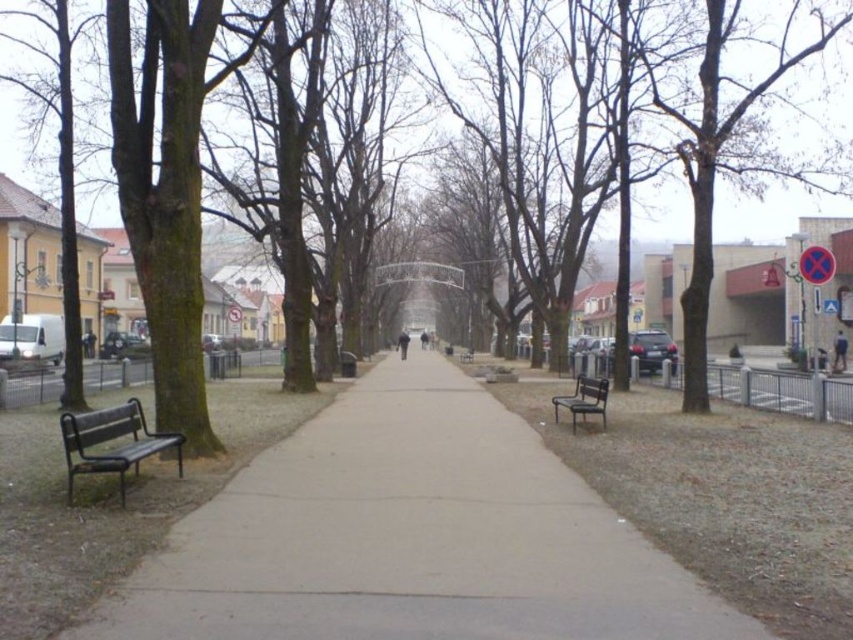
You are planning to hang a bird feeder on the brown rough tree at left and the metallic black bench at left. Which object can support the feeder better based on their height?

The brown rough tree at left has a greater height compared to the metallic black bench at left, so it can support the bird feeder better.

You are standing at the starting point of the pathway in the park and want to walk towards the end of the pathway. Which point, point [125,22] or point [122,445], is closer to you as you begin your walk?

Point [125,22] is closer to you because it is further to the camera than point [122,445], meaning it is nearer to your starting position at the beginning of the pathway.

You are a park visitor sitting on the wooden bench at center. Looking around, you notice the brown rough tree at left. Is the tree positioned higher up compared to your current seating position?

The brown rough tree at left is above the wooden bench at center, so yes, the tree is positioned higher up compared to your current seating position on the wooden bench at center.